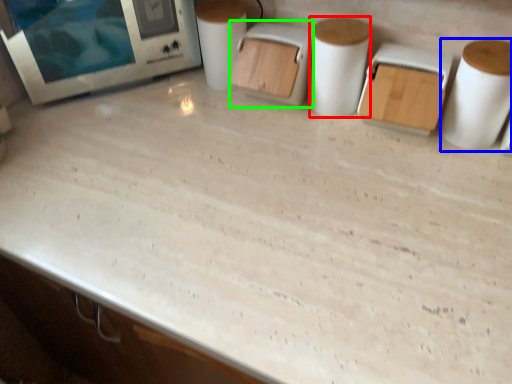
Question: Which object is the farthest from paper towel (highlighted by a red box)? Choose among these: paper towel (highlighted by a blue box) or appliance (highlighted by a green box).

Choices:
 (A) paper towel
 (B) appliance

Answer: (A)